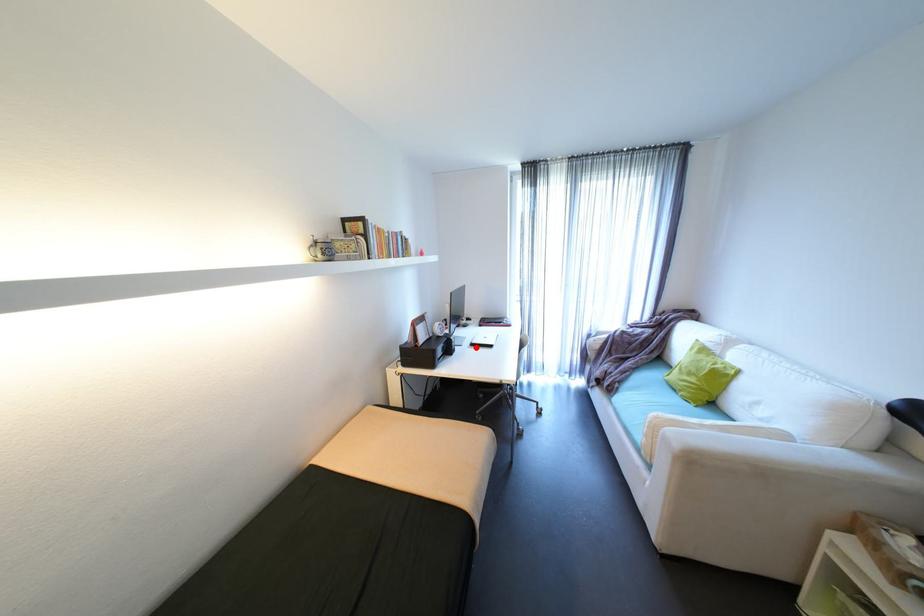
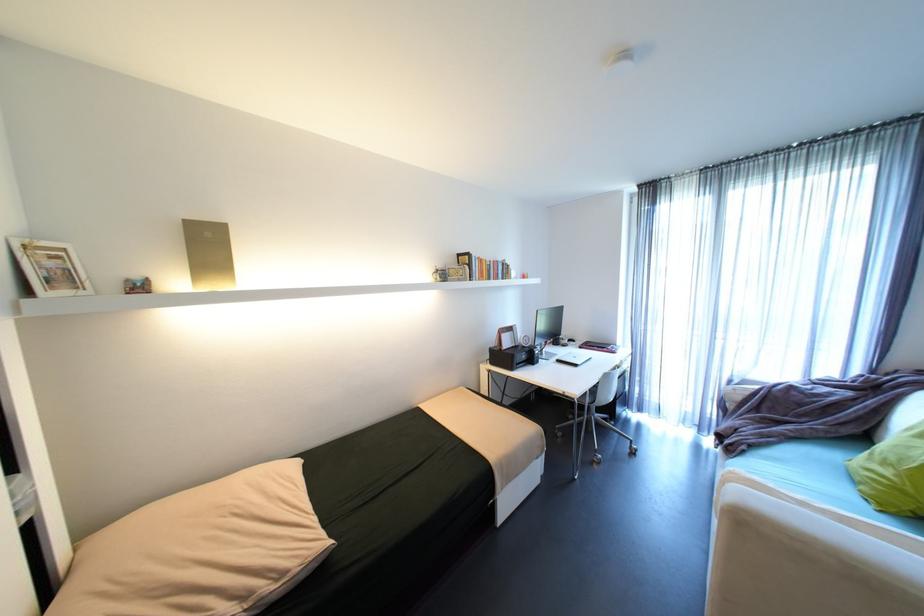
Where in the second image is the point corresponding to the highlighted location from the first image?

(562, 363)